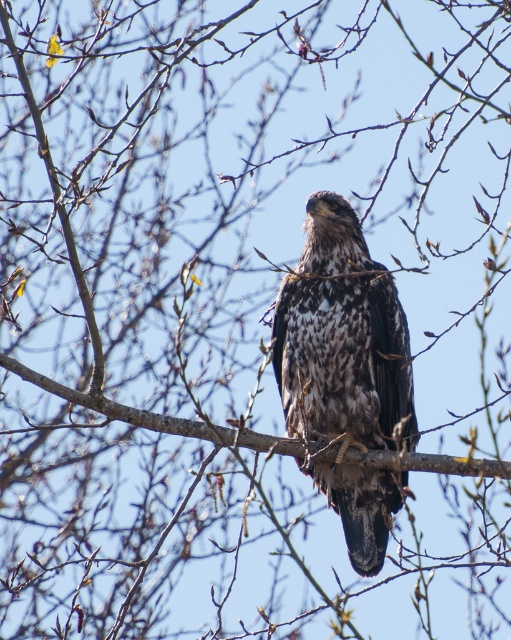
Can you confirm if speckled feathers falcon at center is positioned to the right of brown textured branch at center?

Yes, speckled feathers falcon at center is to the right of brown textured branch at center.

Is point (365, 307) closer to camera compared to point (57, 385)?

No, it is not.

You are a GUI agent. You are given a task and a screenshot of the screen. Output one action in this format:
    pyautogui.click(x=<x>, y=<y>)
    Task: Click on the speckled feathers falcon at center
    
    Given the screenshot: What is the action you would take?
    pyautogui.click(x=345, y=371)